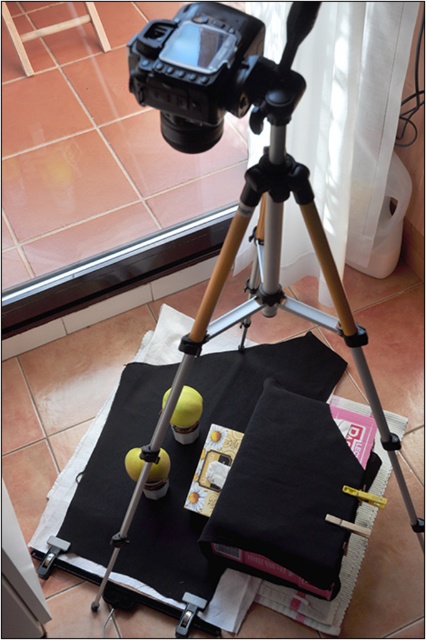
Question: Can you confirm if black matte cloth at center is thinner than wooden stool at upper left?

Choices:
 (A) yes
 (B) no

Answer: (A)

Question: Can you confirm if black matte cloth at center is positioned to the right of wooden stool at upper left?

Choices:
 (A) yes
 (B) no

Answer: (A)

Question: Which point is closer to the camera taking this photo?

Choices:
 (A) (86, 20)
 (B) (284, 468)

Answer: (B)

Question: Which object appears closest to the camera in this image?

Choices:
 (A) black matte cloth at center
 (B) wooden stool at upper left

Answer: (A)

Question: Considering the relative positions of black matte cloth at center and wooden stool at upper left in the image provided, where is black matte cloth at center located with respect to wooden stool at upper left?

Choices:
 (A) below
 (B) above

Answer: (A)